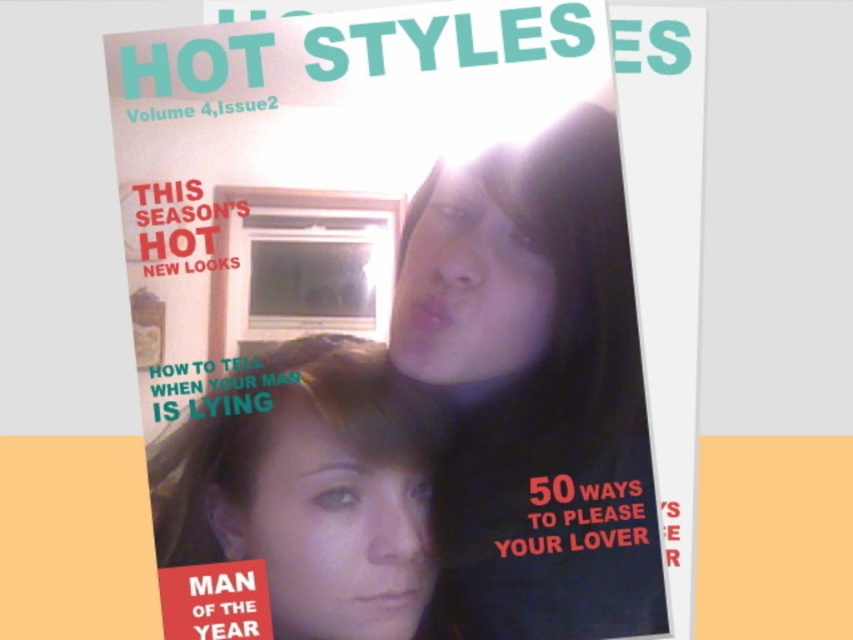
The image size is (853, 640). I want to click on matte plastic magazine at center, so click(419, 266).

Can you confirm if matte plastic magazine at center is bigger than smooth skin face at center?

Correct, matte plastic magazine at center is larger in size than smooth skin face at center.

Between point (602, 520) and point (314, 602), which one is positioned in front?

Positioned in front is point (314, 602).

You are a GUI agent. You are given a task and a screenshot of the screen. Output one action in this format:
    pyautogui.click(x=<x>, y=<y>)
    Task: Click on the matte plastic magazine at center
    The height and width of the screenshot is (640, 853).
    Given the screenshot: What is the action you would take?
    pyautogui.click(x=419, y=266)

Does matte plastic magazine at center have a larger size compared to smooth skin face at upper right?

Correct, matte plastic magazine at center is larger in size than smooth skin face at upper right.

Can you confirm if matte plastic magazine at center is shorter than smooth skin face at upper right?

No, matte plastic magazine at center is not shorter than smooth skin face at upper right.

Who is more forward, (474, 246) or (416, 323)?

Point (416, 323)

The image size is (853, 640). Identify the location of matte plastic magazine at center. (419, 266).

Who is taller, smooth skin face at upper right or smooth skin face at center?

smooth skin face at upper right is taller.

Based on the photo, who is shorter, smooth skin face at upper right or smooth skin face at center?

smooth skin face at center is shorter.

Which is behind, point (492, 600) or point (344, 499)?

The point (344, 499) is more distant.

Where is `smooth skin face at upper right`? smooth skin face at upper right is located at coordinates (534, 388).